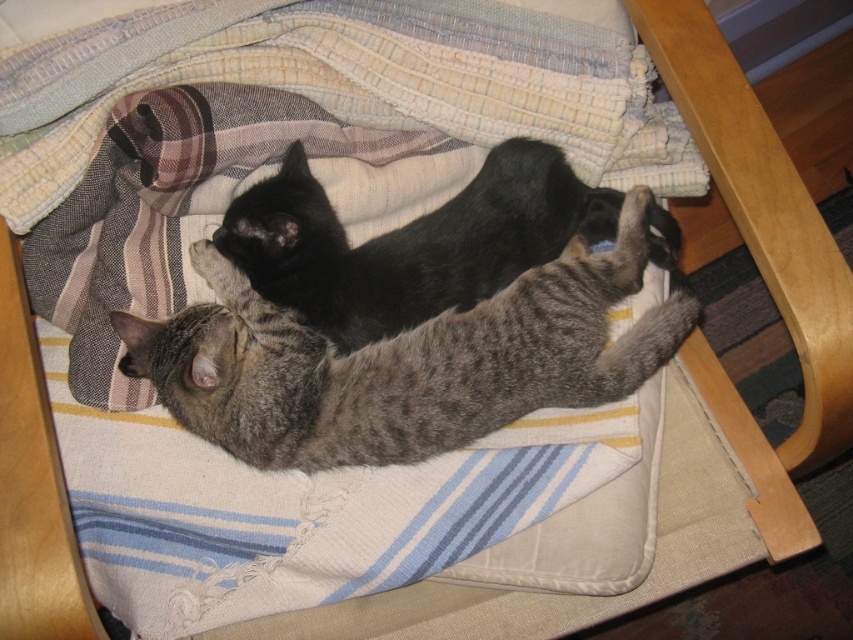
Question: Is gray striped cat at center behind black fur cat at upper center?

Choices:
 (A) yes
 (B) no

Answer: (B)

Question: Is gray striped cat at center bigger than black fur cat at upper center?

Choices:
 (A) no
 (B) yes

Answer: (B)

Question: Among these points, which one is farthest from the camera?

Choices:
 (A) (434, 417)
 (B) (424, 296)

Answer: (B)

Question: Among these objects, which one is nearest to the camera?

Choices:
 (A) black fur cat at upper center
 (B) gray striped cat at center

Answer: (B)

Question: Which of the following is the closest to the observer?

Choices:
 (A) (200, 362)
 (B) (666, 227)

Answer: (A)

Question: Is the position of gray striped cat at center more distant than that of black fur cat at upper center?

Choices:
 (A) yes
 (B) no

Answer: (B)